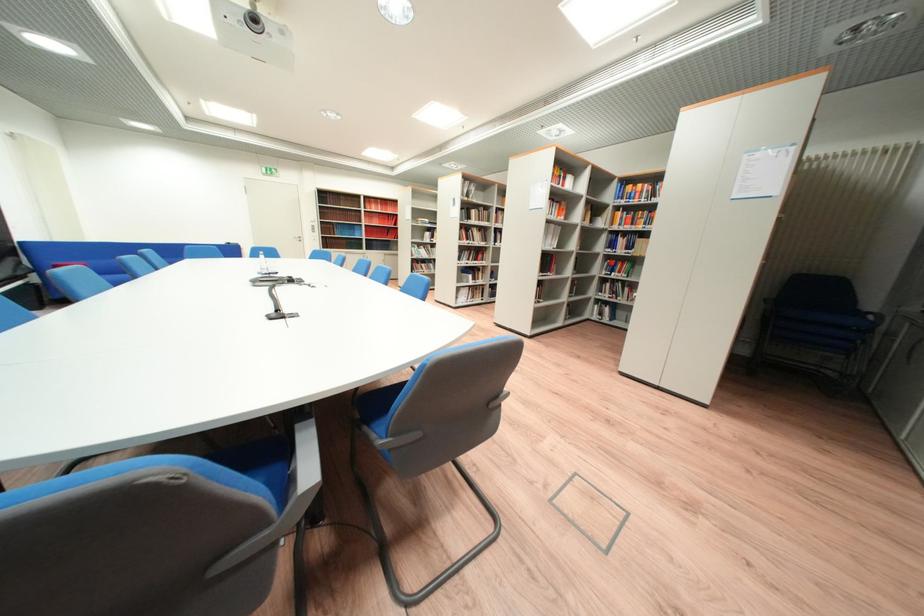
Locate an element on the screen. This screenshot has height=616, width=924. grey chair armrest is located at coordinates (304, 463).